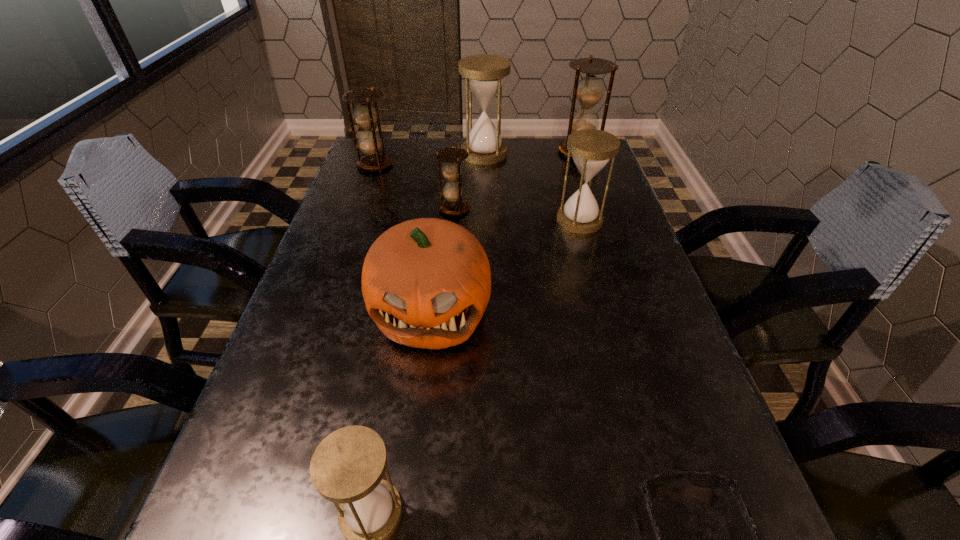
This screenshot has height=540, width=960. Find the location of `the biggest white hourglass`. the biggest white hourglass is located at coordinates (484, 74).

Locate an element on the screen. the second white hourglass from left to right is located at coordinates (484, 74).

Where is `the biggest brown hourglass`? The width and height of the screenshot is (960, 540). the biggest brown hourglass is located at coordinates click(x=589, y=90).

Image resolution: width=960 pixels, height=540 pixels. In order to click on the leftmost hourglass in this screenshot , I will do `click(365, 115)`.

The image size is (960, 540). I want to click on the leftmost brown hourglass, so click(365, 115).

Where is `the rightmost white hourglass`? Image resolution: width=960 pixels, height=540 pixels. the rightmost white hourglass is located at coordinates (591, 149).

The width and height of the screenshot is (960, 540). I want to click on the second smallest white hourglass, so click(591, 149).

The width and height of the screenshot is (960, 540). I want to click on the sixth farthest object, so click(426, 283).

Locate an element on the screen. This screenshot has height=540, width=960. the nearest brown hourglass is located at coordinates (451, 156).

Locate an element on the screen. Image resolution: width=960 pixels, height=540 pixels. the second brown hourglass from right to left is located at coordinates (451, 156).